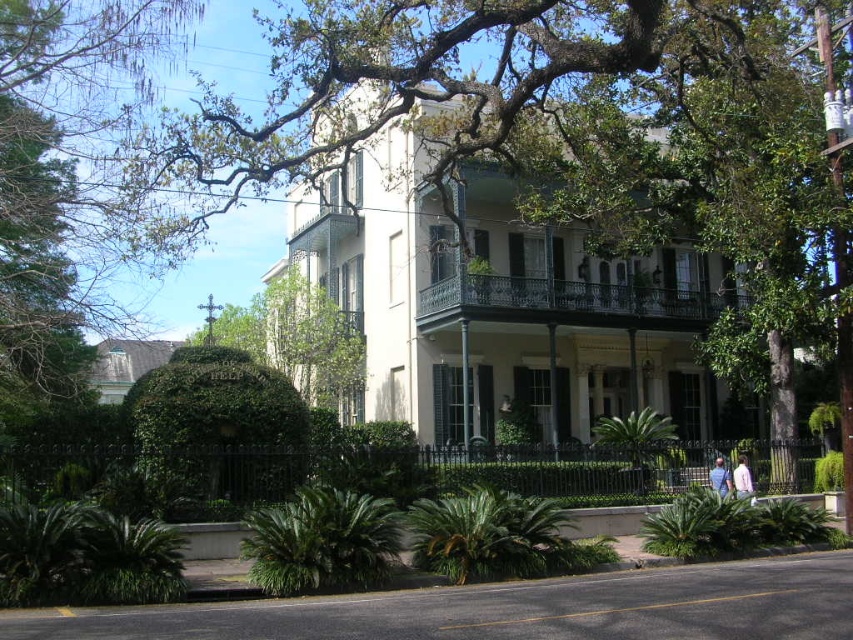
Can you confirm if green leafy tree at center is positioned below dark green wrought iron porch at center?

No, green leafy tree at center is not below dark green wrought iron porch at center.

Between green leafy tree at center and dark green wrought iron porch at center, which one has more height?

green leafy tree at center

Is point (228, 188) less distant than point (460, 275)?

That is False.

Identify the location of green leafy tree at center. (384, 93).

Between green leafy tree at center and green leafy tree at upper left, which one has more height?

Standing taller between the two is green leafy tree at center.

Is the position of green leafy tree at center more distant than that of green leafy tree at upper left?

No, it is not.

Is point (450, 86) more distant than point (151, 51)?

No, (450, 86) is closer to viewer.

Where is `green leafy tree at center`? green leafy tree at center is located at coordinates (384, 93).

The width and height of the screenshot is (853, 640). What do you see at coordinates (62, 172) in the screenshot?
I see `green leafy tree at upper left` at bounding box center [62, 172].

Does green leafy tree at upper left have a lesser width compared to pink fabric shirt at lower right?

No, green leafy tree at upper left is not thinner than pink fabric shirt at lower right.

What do you see at coordinates (62, 172) in the screenshot? The height and width of the screenshot is (640, 853). I see `green leafy tree at upper left` at bounding box center [62, 172].

Where is `green leafy tree at upper left`? Image resolution: width=853 pixels, height=640 pixels. green leafy tree at upper left is located at coordinates (62, 172).